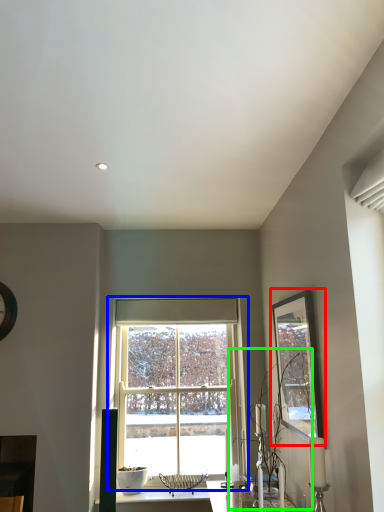
Question: Which is farther away from picture frame (highlighted by a red box)? window (highlighted by a blue box) or plant (highlighted by a green box)?

Choices:
 (A) window
 (B) plant

Answer: (A)